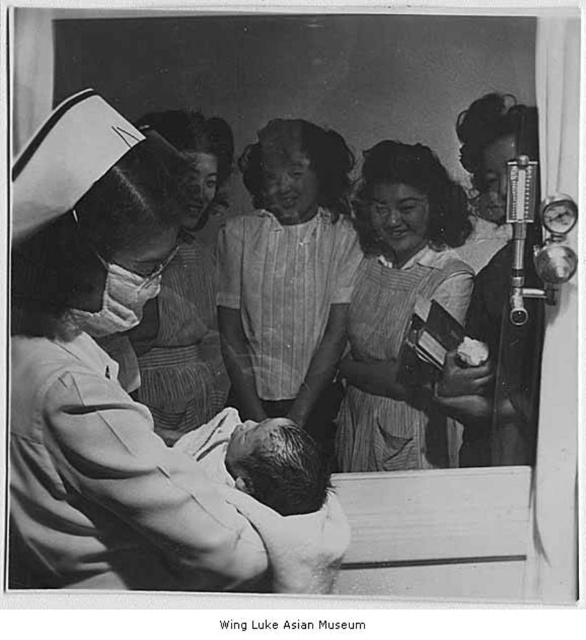
In the scene shown: Who is positioned more to the left, striped fabric blouse at center or smooth fabric dress at right?

Positioned to the left is striped fabric blouse at center.

Between striped fabric blouse at center and smooth fabric dress at right, which one appears on the right side from the viewer's perspective?

From the viewer's perspective, smooth fabric dress at right appears more on the right side.

Is point (257, 385) positioned after point (473, 456)?

That is True.

Where is `striped fabric blouse at center`? striped fabric blouse at center is located at coordinates (287, 275).

Based on the photo, does white clothed nurse at left appear on the right side of striped fabric blouse at center?

No, white clothed nurse at left is not to the right of striped fabric blouse at center.

Is white clothed nurse at left smaller than striped fabric blouse at center?

Incorrect, white clothed nurse at left is not smaller in size than striped fabric blouse at center.

Does point (110, 122) come in front of point (287, 314)?

Yes, point (110, 122) is closer to viewer.

What are the coordinates of `white clothed nurse at left` in the screenshot? It's located at (101, 371).

In the scene shown: Who is taller, smooth fabric dress at right or matte white nurse cap at upper left?

Standing taller between the two is smooth fabric dress at right.

Can you confirm if smooth fabric dress at right is smaller than matte white nurse cap at upper left?

Correct, smooth fabric dress at right occupies less space than matte white nurse cap at upper left.

Between point (532, 228) and point (173, 310), which one is positioned behind?

The point (173, 310) is more distant.

Locate an element on the screen. The width and height of the screenshot is (586, 640). smooth fabric dress at right is located at coordinates (495, 372).